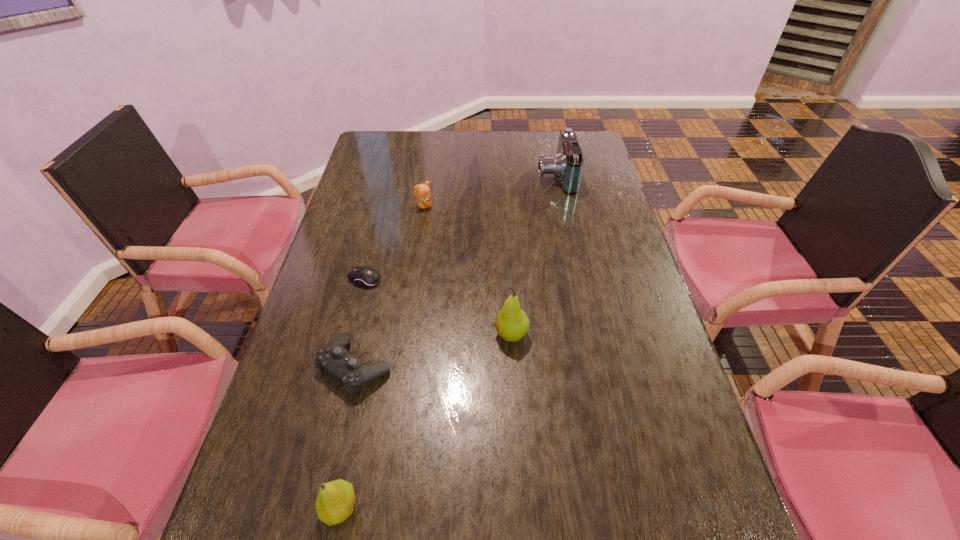
Identify the location of vacant area at the right edge. (636, 387).

You are a GUI agent. You are given a task and a screenshot of the screen. Output one action in this format:
    pyautogui.click(x=<x>, y=<y>)
    Task: Click on the free space at the far left corner of the desktop
    
    Given the screenshot: What is the action you would take?
    pyautogui.click(x=402, y=156)

Image resolution: width=960 pixels, height=540 pixels. What are the coordinates of `free space at the far right corner of the desktop` in the screenshot? It's located at (591, 144).

Where is `vacant area at the near right corner`? vacant area at the near right corner is located at coordinates 629,469.

Identify the location of free space between the tallest object and the rightmost object. This screenshot has height=540, width=960. (533, 255).

Identify the location of free space between the second shortest object and the taller pear. The image size is (960, 540). (433, 351).

Locate an element on the screen. The height and width of the screenshot is (540, 960). empty location between the nearest object and the farther pear is located at coordinates [x=425, y=421].

At what (x,y) coordinates should I click in order to perform the action: click on blank region between the right pear and the rightmost object. Please return your answer as a coordinate pair (x, y). The width and height of the screenshot is (960, 540). Looking at the image, I should click on (533, 255).

Find the location of `free spot between the third farthest object and the second object from right to left`. free spot between the third farthest object and the second object from right to left is located at coordinates (438, 307).

At what (x,y) coordinates should I click in order to perform the action: click on vacant space that is in between the left pear and the fifth tallest object. Please return your answer as a coordinate pair (x, y). Looking at the image, I should click on (348, 438).